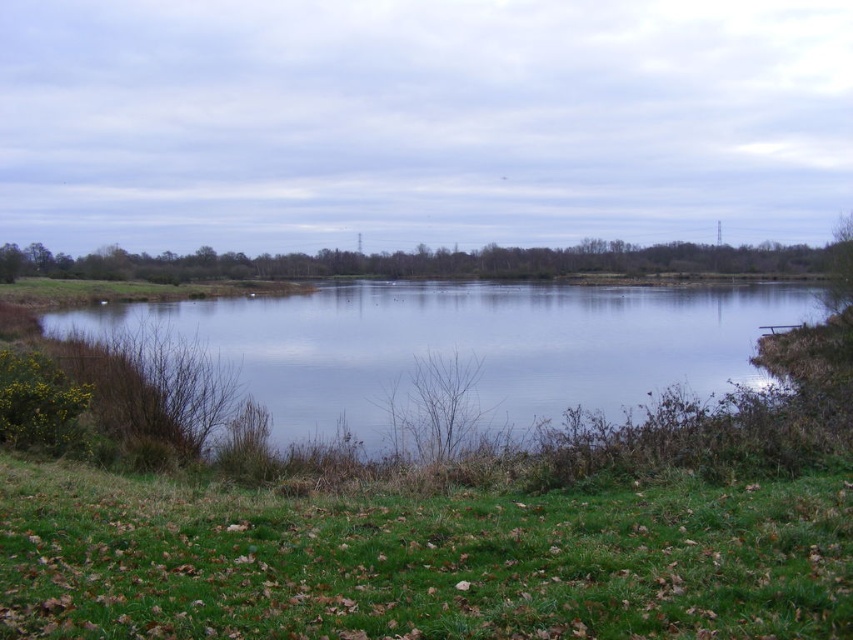
Between point (584, 582) and point (563, 372), which one is positioned in front?

Positioned in front is point (584, 582).

Which of these two, green grassy at lower left or transparent water at center, stands shorter?

green grassy at lower left is shorter.

The image size is (853, 640). In order to click on green grassy at lower left in this screenshot , I will do `click(422, 563)`.

I want to click on green grassy at lower left, so click(x=422, y=563).